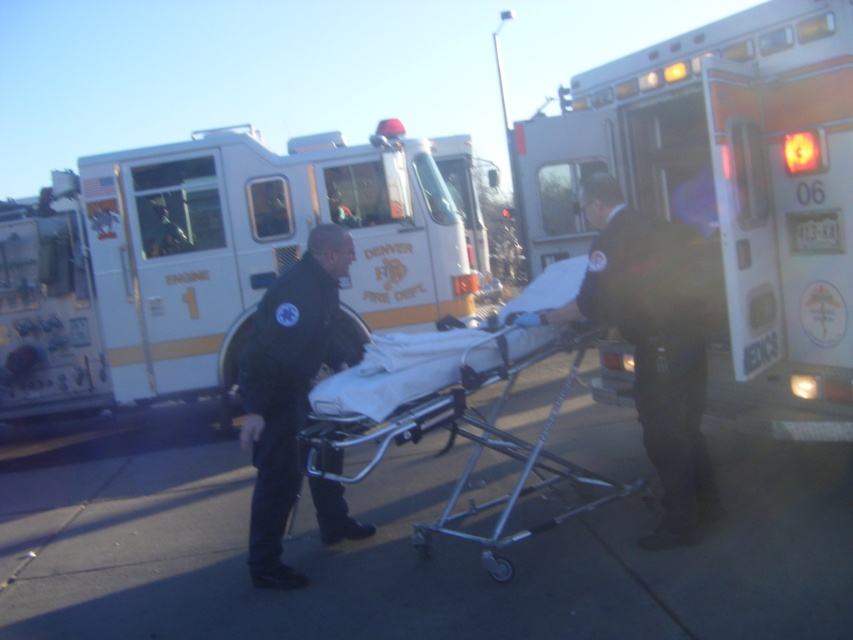
Is point (376, 186) positioned in front of point (253, 547)?

No, it is behind (253, 547).

Does white glossy fire truck at center appear under black matte uniform at center?

Incorrect, white glossy fire truck at center is not positioned below black matte uniform at center.

Which is in front, point (64, 230) or point (244, 435)?

Point (244, 435)

Where is `white glossy fire truck at center`? This screenshot has height=640, width=853. white glossy fire truck at center is located at coordinates (215, 257).

Can you confirm if metallic silver stretcher at center is taller than black fabric suit at center?

Incorrect, metallic silver stretcher at center's height is not larger of black fabric suit at center's.

Does point (339, 422) come in front of point (572, 310)?

Yes, it is.

Measure the distance between metallic silver stretcher at center and camera.

3.71 meters

Locate an element on the screen. metallic silver stretcher at center is located at coordinates (457, 408).

Between white glossy fire truck at center and silver metallic ambulance at right, which one is positioned lower?

silver metallic ambulance at right is lower down.

Which is behind, point (59, 413) or point (744, 420)?

Positioned behind is point (59, 413).

The width and height of the screenshot is (853, 640). What do you see at coordinates (215, 257) in the screenshot? I see `white glossy fire truck at center` at bounding box center [215, 257].

Image resolution: width=853 pixels, height=640 pixels. I want to click on white glossy fire truck at center, so click(x=215, y=257).